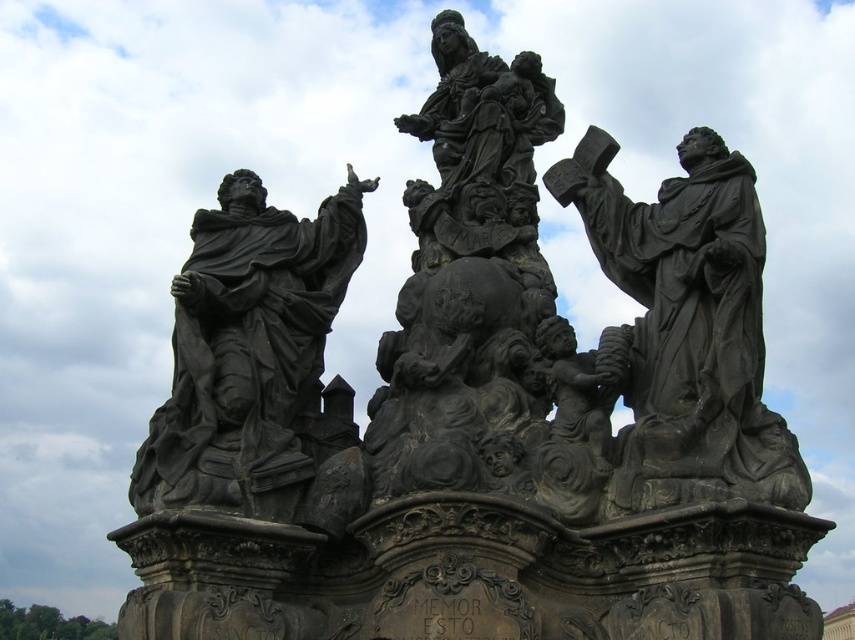
Question: Is matte black statue at right below matte black statue at left?

Choices:
 (A) yes
 (B) no

Answer: (B)

Question: Which of the following is the farthest from the observer?

Choices:
 (A) matte black statue at right
 (B) matte black statue at left

Answer: (B)

Question: Which point is farther to the camera?

Choices:
 (A) matte black statue at right
 (B) matte black statue at left

Answer: (B)

Question: Is matte black statue at right positioned at the back of matte black statue at left?

Choices:
 (A) no
 (B) yes

Answer: (A)

Question: Which point is farther to the camera?

Choices:
 (A) (773, 449)
 (B) (139, 472)

Answer: (B)

Question: Does matte black statue at right appear under matte black statue at left?

Choices:
 (A) yes
 (B) no

Answer: (B)